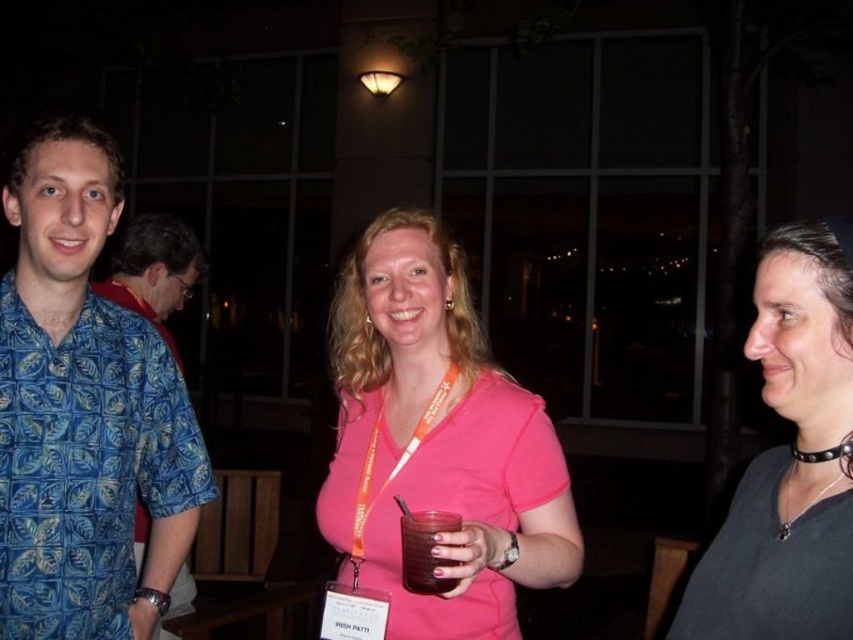
Who is shorter, pink matte shirt at center or black leather choker at right?

black leather choker at right is shorter.

Is point (564, 577) positioned before point (828, 244)?

That is False.

Find the location of a particular element. This screenshot has height=640, width=853. pink matte shirt at center is located at coordinates (433, 449).

Is point (798, 234) less distant than point (120, 269)?

Yes, it is in front of point (120, 269).

Identify the location of black leather choker at right. This screenshot has height=640, width=853. (790, 458).

What do you see at coordinates (790, 458) in the screenshot?
I see `black leather choker at right` at bounding box center [790, 458].

This screenshot has width=853, height=640. I want to click on black leather choker at right, so (x=790, y=458).

Is point (175, 273) behind point (419, 529)?

Yes, it is.

Between blue patterned shirt at left and translucent plastic cup at center, which one has less height?

translucent plastic cup at center

Is point (178, 276) positioned in front of point (434, 541)?

No, (178, 276) is further to viewer.

Locate an element on the screen. This screenshot has width=853, height=640. blue patterned shirt at left is located at coordinates (154, 269).